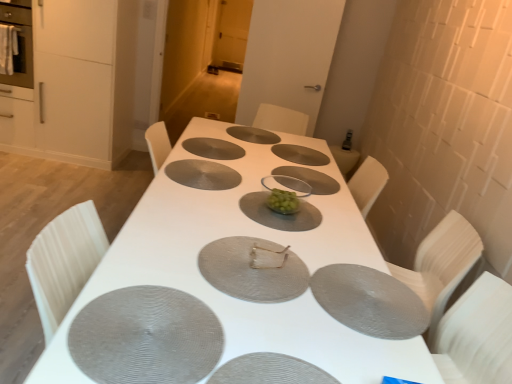
At what (x,y) coordinates should I click in order to perform the action: click on vacant area that is situated to the right of matte gray pizza pan at center, which appears as the sixth pizza pan when viewed from the front. Please return your answer as a coordinate pair (x, y). The image size is (512, 384). Looking at the image, I should click on (262, 150).